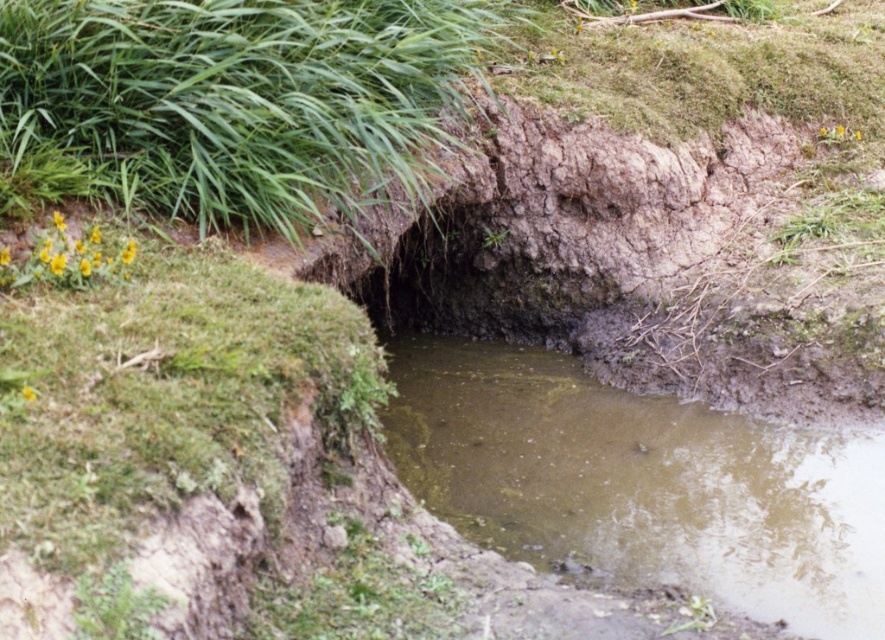
You are a frog trying to jump from the brown muddy stream at center to the green grass at upper left. Considering their sizes, which area will provide a more stable landing spot?

The green grass at upper left is larger than the brown muddy stream at center, so it will provide a more stable landing spot for the frog.

You are a frog trying to jump from the brown muddy stream at center to the green grass at upper left. Which one is shorter in height?

The brown muddy stream at center is shorter in height than the green grass at upper left.

You are standing at the edge of the brown muddy stream at center and want to walk towards the green grass at upper left. Which direction should you head to avoid the water?

The green grass at upper left is behind the brown muddy stream at center, so to reach it without entering the water, you should move towards the upper left direction away from the stream.